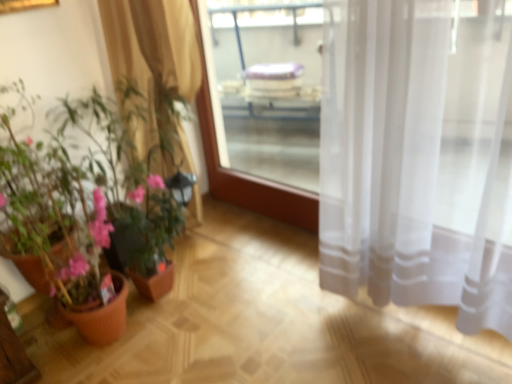
The image size is (512, 384). What do you see at coordinates (152, 54) in the screenshot? I see `beige sheer curtain at left` at bounding box center [152, 54].

Locate an element on the screen. Image resolution: width=512 pixels, height=384 pixels. beige sheer curtain at left is located at coordinates (152, 54).

Locate an element on the screen. This screenshot has width=512, height=384. beige sheer curtain at left is located at coordinates (152, 54).

From a real-world perspective, is terracotta pot plant at left positioned under transparent glass window screen at center based on gravity?

No.

Who is more distant, terracotta pot plant at left or transparent glass window screen at center?

transparent glass window screen at center is further away from the camera.

Between point (52, 182) and point (294, 7), which one is positioned in front?

Point (52, 182)

Is transparent glass window screen at center located within terracotta pot plant at left?

No, transparent glass window screen at center is not inside terracotta pot plant at left.

From the image's perspective, is transparent glass window screen at center located beneath terracotta pot plant at left?

Actually, transparent glass window screen at center appears above terracotta pot plant at left in the image.

Who is bigger, transparent glass window screen at center or terracotta pot plant at left?

terracotta pot plant at left is bigger.

In terms of width, does transparent glass window screen at center look wider or thinner when compared to terracotta pot plant at left?

In the image, transparent glass window screen at center appears to be more narrow than terracotta pot plant at left.

Where is `window screen located behind the terracotta pot plant at left`? window screen located behind the terracotta pot plant at left is located at coordinates (267, 86).

Between beige sheer curtain at left and transparent glass window screen at center, which one has larger size?

beige sheer curtain at left.

Is beige sheer curtain at left facing towards transparent glass window screen at center?

No.

Between point (170, 37) and point (225, 104), which one is positioned behind?

The point (225, 104) is farther.

Is the depth of beige sheer curtain at left greater than that of transparent glass window screen at center?

No, it is in front of transparent glass window screen at center.

Which of these two, terracotta pot plant at left or beige sheer curtain at left, is bigger?

terracotta pot plant at left is bigger.

Does terracotta pot plant at left turn towards beige sheer curtain at left?

No, terracotta pot plant at left is not turned towards beige sheer curtain at left.

Is terracotta pot plant at left to the left or to the right of beige sheer curtain at left in the image?

In the image, terracotta pot plant at left appears on the left side of beige sheer curtain at left.

Which of these two, beige sheer curtain at left or terracotta pot plant at left, is smaller?

Smaller between the two is beige sheer curtain at left.

At what (x,y) coordinates should I click in order to perform the action: click on houseplant to the left of beige sheer curtain at left. Please return your answer as a coordinate pair (x, y). The image size is (512, 384). Looking at the image, I should click on (87, 206).

Is beige sheer curtain at left taller or shorter than terracotta pot plant at left?

beige sheer curtain at left is shorter than terracotta pot plant at left.

Considering the sizes of transparent glass window screen at center and beige sheer curtain at left in the image, is transparent glass window screen at center taller or shorter than beige sheer curtain at left?

In the image, transparent glass window screen at center appears to be shorter than beige sheer curtain at left.

Is transparent glass window screen at center located outside beige sheer curtain at left?

Yes, transparent glass window screen at center is not within beige sheer curtain at left.

From a real-world perspective, is transparent glass window screen at center physically above beige sheer curtain at left?

No, from a real-world perspective, transparent glass window screen at center is not on top of beige sheer curtain at left.

Is transparent glass window screen at center positioned with its back to beige sheer curtain at left?

Yes, transparent glass window screen at center's orientation is away from beige sheer curtain at left.

Identify the location of window screen lying behind the terracotta pot plant at left. (267, 86).

Where is `window screen on the right of terracotta pot plant at left`? Image resolution: width=512 pixels, height=384 pixels. window screen on the right of terracotta pot plant at left is located at coordinates (267, 86).

Based on their spatial positions, is transparent glass window screen at center or terracotta pot plant at left closer to beige sheer curtain at left?

terracotta pot plant at left lies closer to beige sheer curtain at left than the other object.

From the image, which object appears to be farther from transparent glass window screen at center, terracotta pot plant at left or beige sheer curtain at left?

terracotta pot plant at left is further to transparent glass window screen at center.

When comparing their distances from terracotta pot plant at left, does beige sheer curtain at left or transparent glass window screen at center seem further?

Based on the image, transparent glass window screen at center appears to be further to terracotta pot plant at left.

From the image, which object appears to be farther from terracotta pot plant at left, transparent glass window screen at center or beige sheer curtain at left?

Among the two, transparent glass window screen at center is located further to terracotta pot plant at left.

Considering their positions, is beige sheer curtain at left positioned closer to transparent glass window screen at center than terracotta pot plant at left?

beige sheer curtain at left.

Considering their positions, is terracotta pot plant at left positioned closer to beige sheer curtain at left than transparent glass window screen at center?

Among the two, terracotta pot plant at left is located nearer to beige sheer curtain at left.

In order to click on curtain positioned between terracotta pot plant at left and transparent glass window screen at center from near to far in this screenshot , I will do `click(152, 54)`.